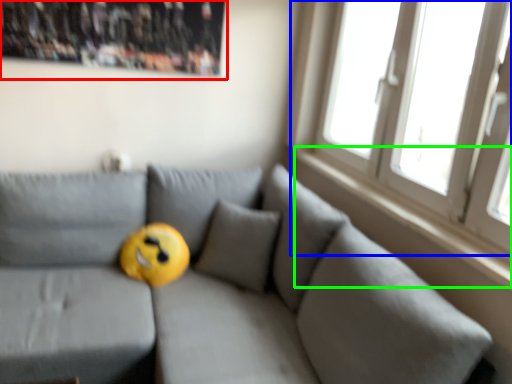
Question: Estimate the real-world distances between objects in this image. Which object is farther from bulletin board (highlighted by a red box), window (highlighted by a blue box) or window sill (highlighted by a green box)?

Choices:
 (A) window
 (B) window sill

Answer: (B)